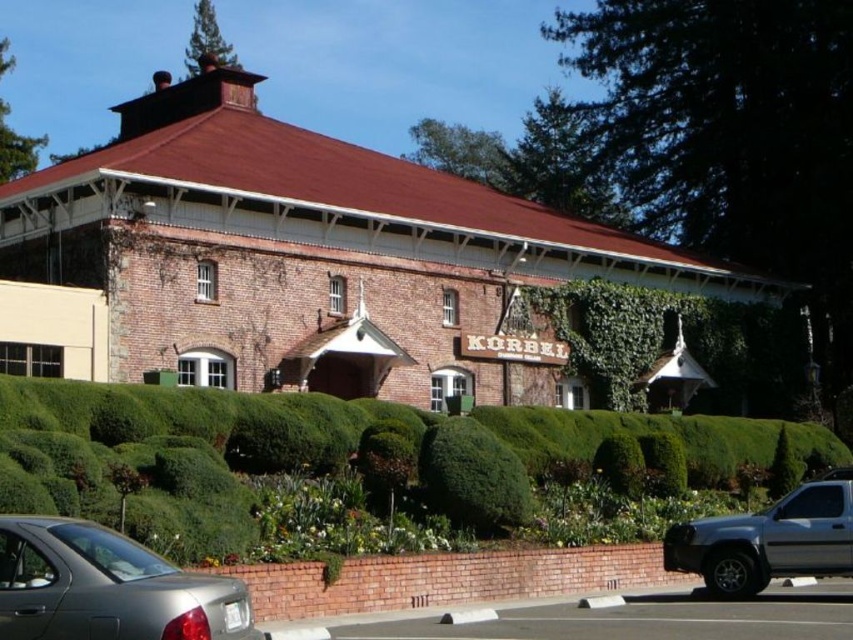
Question: Is green leafy hedge at center above satin silver sedan at lower left?

Choices:
 (A) yes
 (B) no

Answer: (A)

Question: Which object is farther from the camera taking this photo?

Choices:
 (A) green leafy bush at center
 (B) green leafy hedge at center
 (C) silver metallic truck at lower right

Answer: (A)

Question: Considering the real-world distances, which object is closest to the green leafy hedge at center?

Choices:
 (A) green leafy bush at center
 (B) satin silver sedan at lower left

Answer: (A)

Question: Does green leafy hedge at center have a larger size compared to satin silver sedan at lower left?

Choices:
 (A) no
 (B) yes

Answer: (B)

Question: Does green leafy hedge at center come behind satin silver sedan at lower left?

Choices:
 (A) yes
 (B) no

Answer: (A)

Question: Based on their relative distances, which object is nearer to the silver metallic truck at lower right?

Choices:
 (A) green leafy bush at center
 (B) satin silver sedan at lower left
 (C) green leafy hedge at center

Answer: (A)